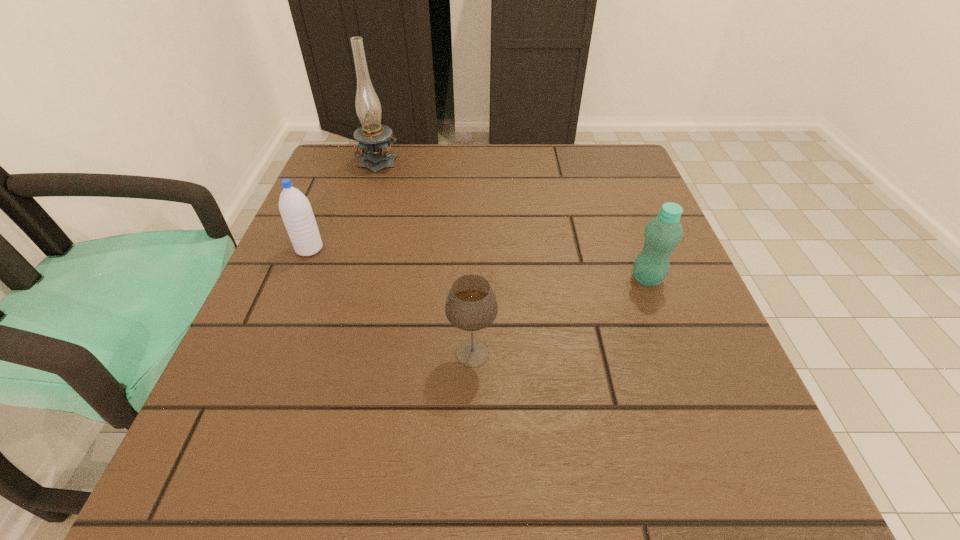
At what (x,y) coordinates should I click in order to perform the action: click on free region located 0.190m at the front cap of the rightmost object. Please return your answer as a coordinate pair (x, y). Image resolution: width=960 pixels, height=540 pixels. Looking at the image, I should click on (531, 279).

Locate an element on the screen. vacant region located 0.400m at the front cap of the rightmost object is located at coordinates (420, 279).

I want to click on vacant space situated on the back of the farther water bottle, so click(348, 154).

Where is `free location located 0.330m on the left of the second object from right to left`? Image resolution: width=960 pixels, height=540 pixels. free location located 0.330m on the left of the second object from right to left is located at coordinates (246, 353).

This screenshot has height=540, width=960. I want to click on object that is at the far edge, so click(374, 139).

Identify the location of oil lamp at the left edge. 374,139.

Identify the location of water bottle located at the left edge. Image resolution: width=960 pixels, height=540 pixels. (295, 209).

Identify the location of object present at the right edge. The width and height of the screenshot is (960, 540). (663, 233).

Where is `object located in the far left corner section of the desktop`? object located in the far left corner section of the desktop is located at coordinates (374, 139).

The height and width of the screenshot is (540, 960). Find the location of `vacant point at the far edge`. vacant point at the far edge is located at coordinates (530, 156).